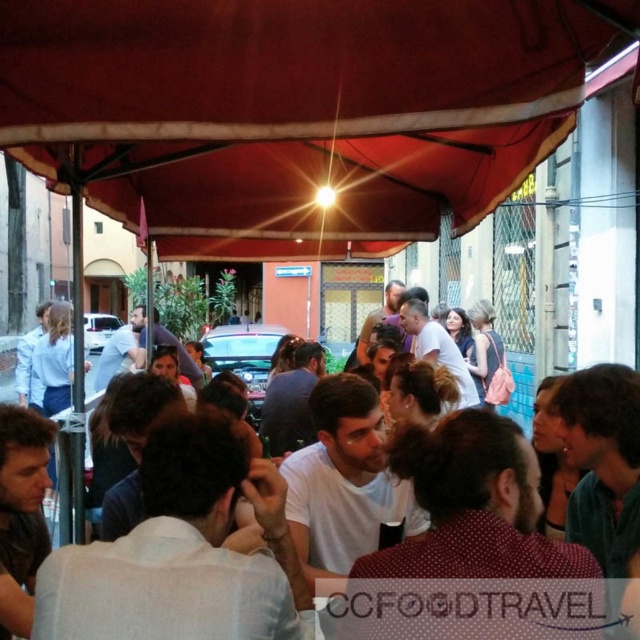
Who is positioned more to the left, red fabric canopy at center or white cotton shirt at center?

Positioned to the left is red fabric canopy at center.

Is red fabric canopy at center positioned behind white cotton shirt at center?

Yes, it is.

Between point (282, 237) and point (452, 637), which one is positioned behind?

The point (282, 237) is behind.

What are the coordinates of `red fabric canopy at center` in the screenshot? It's located at (294, 112).